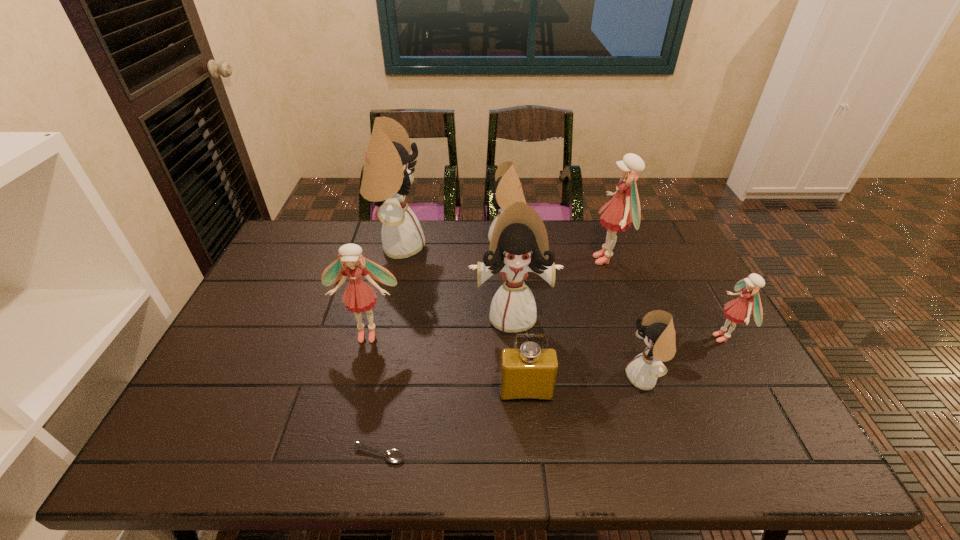
Locate an element on the screen. The height and width of the screenshot is (540, 960). free space between the second smallest black doll and the leftmost pink doll is located at coordinates (438, 287).

The width and height of the screenshot is (960, 540). I want to click on free point between the tallest doll and the eighth tallest object, so click(x=462, y=320).

Locate an element on the screen. The height and width of the screenshot is (540, 960). free space between the leftmost pink doll and the soupspoon is located at coordinates click(x=373, y=394).

Locate an element on the screen. The width and height of the screenshot is (960, 540). vacant space that is in between the soupspoon and the tallest object is located at coordinates (389, 350).

Locate an element on the screen. This screenshot has height=540, width=960. vacant region between the shortest object and the leftmost pink doll is located at coordinates (373, 394).

You are a GUI agent. You are given a task and a screenshot of the screen. Output one action in this format:
    pyautogui.click(x=<x>, y=<y>)
    Task: Click on the free space between the second pink doll from left to right and the rightmost black doll
    
    Given the screenshot: What is the action you would take?
    pyautogui.click(x=626, y=319)

You are a GUI agent. You are given a task and a screenshot of the screen. Output one action in this format:
    pyautogui.click(x=<x>, y=<y>)
    Task: Click on the vacant space in between the smallest pink doll and the second pink doll from left to right
    The image size is (960, 540).
    Given the screenshot: What is the action you would take?
    pyautogui.click(x=665, y=299)

This screenshot has width=960, height=540. Identify the location of vacant point located between the second pink doll from right to left and the second smallest pink doll. (488, 296).

Identify the location of object that can be found as the second closest to the tallest object. tap(359, 296).

I want to click on object identified as the sixth closest to the tallest doll, so pos(394,456).